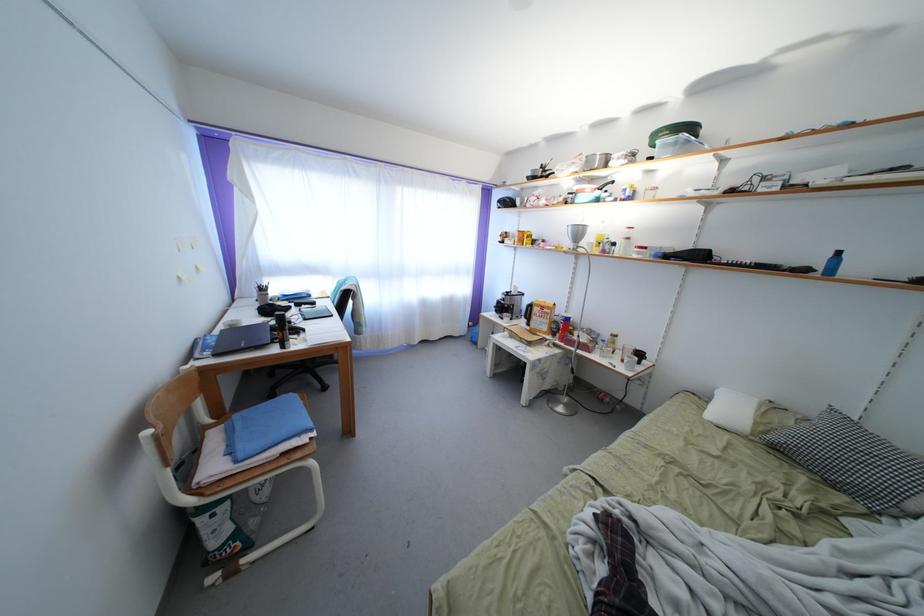
Which object does [855,462] point to?

It corresponds to the patterned pillow in the image.